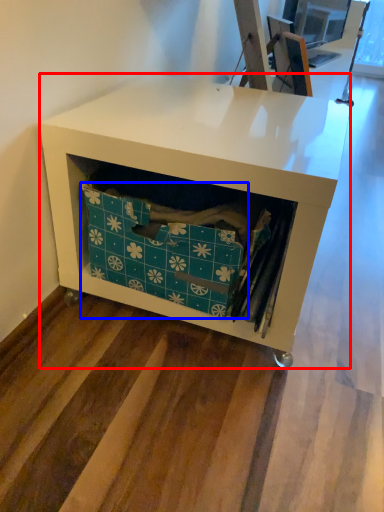
Question: Which point is closer to the camera, desk (highlighted by a red box) or storage box (highlighted by a blue box)?

Choices:
 (A) desk
 (B) storage box

Answer: (A)